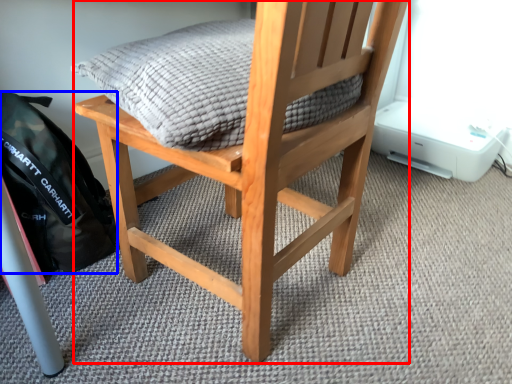
Question: Which object is closer to the camera taking this photo, chair (highlighted by a red box) or backpack (highlighted by a blue box)?

Choices:
 (A) chair
 (B) backpack

Answer: (A)